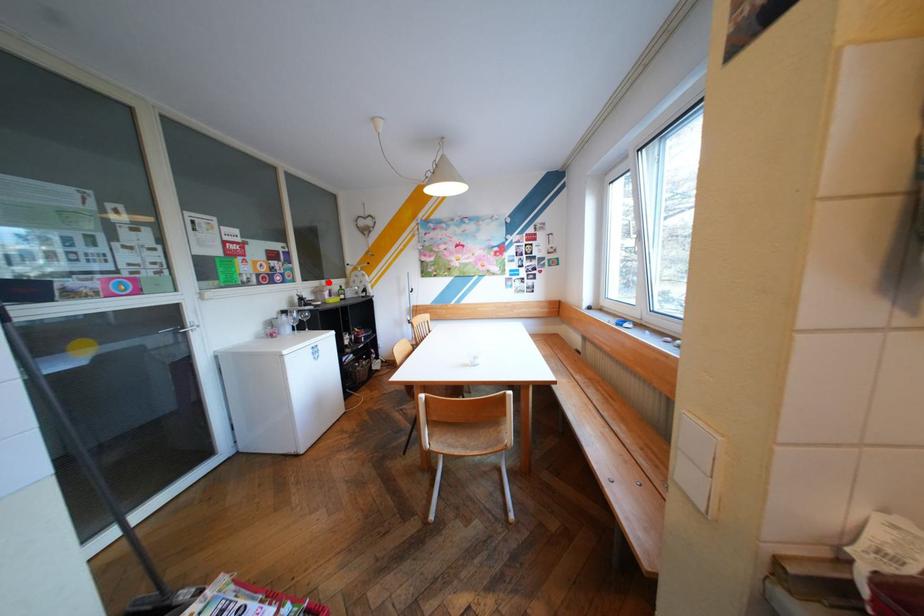
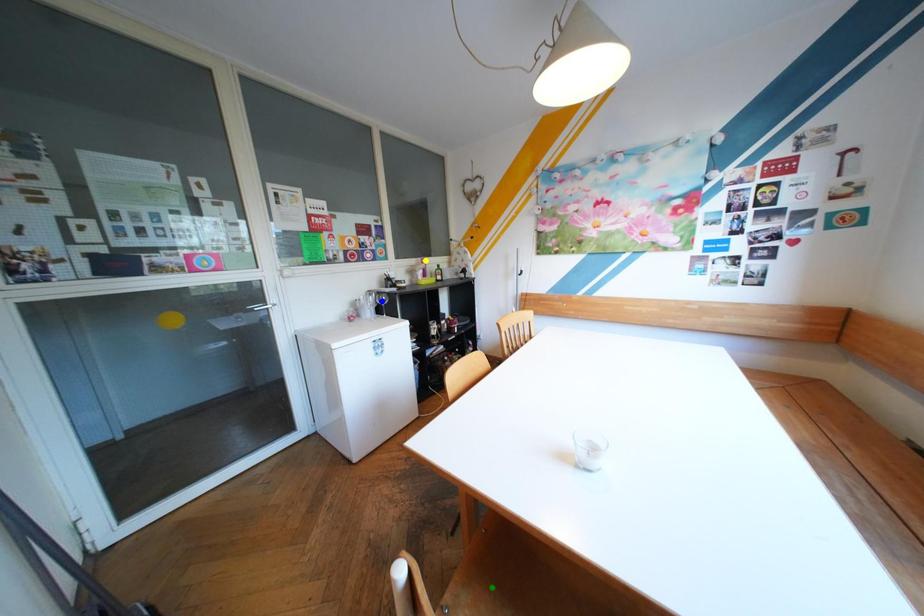
Question: I am providing you with two images of the same scene from different viewpoints. A red point is marked on the first image. You are given multiple points on the second image. Which mark in image 2 goes with the point in image 1?

Choices:
 (A) blue point
 (B) green point
 (C) yellow point

Answer: (C)